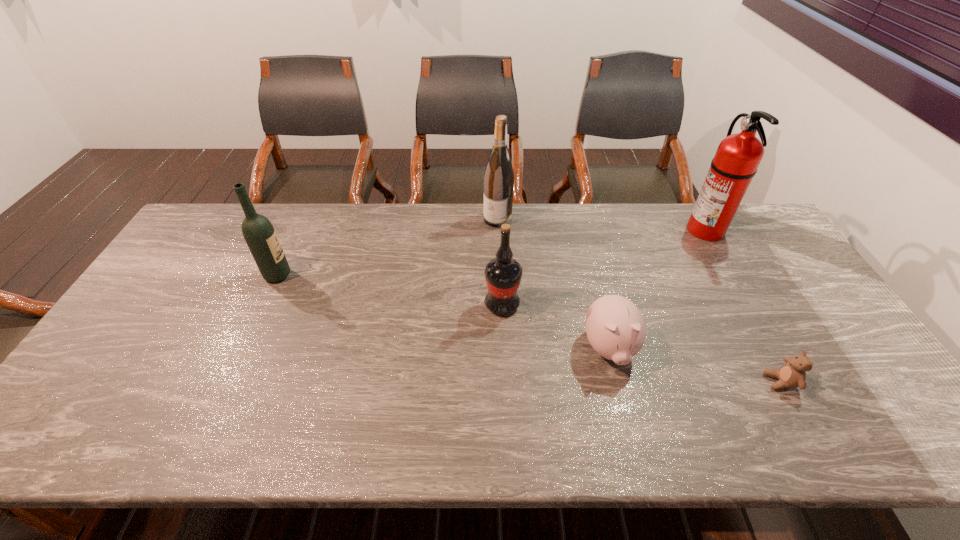
Where is `vacant area situated at the nozzle of the fire extinguisher`? vacant area situated at the nozzle of the fire extinguisher is located at coordinates (572, 230).

This screenshot has height=540, width=960. In order to click on free space located 0.300m on the right of the farthest wine bottle in this screenshot , I will do `click(597, 219)`.

Where is `vacant region located 0.050m on the labeled side of the leftmost wine bottle`? Image resolution: width=960 pixels, height=540 pixels. vacant region located 0.050m on the labeled side of the leftmost wine bottle is located at coordinates (307, 275).

Where is `blank area located on the front of the fourth farthest object`? The height and width of the screenshot is (540, 960). blank area located on the front of the fourth farthest object is located at coordinates (506, 381).

Identify the location of vacant area situated at the snout of the fifth tallest object. The height and width of the screenshot is (540, 960). (621, 398).

Locate an element on the screen. The width and height of the screenshot is (960, 540). free space located on the front-facing side of the teddy bear is located at coordinates (709, 382).

This screenshot has height=540, width=960. I want to click on free space located on the front-facing side of the teddy bear, so click(640, 382).

This screenshot has width=960, height=540. I want to click on free space located on the front-facing side of the teddy bear, so click(657, 382).

The height and width of the screenshot is (540, 960). I want to click on fire extinguisher situated at the far edge, so click(x=738, y=156).

Identify the location of wine bottle present at the far edge. (499, 177).